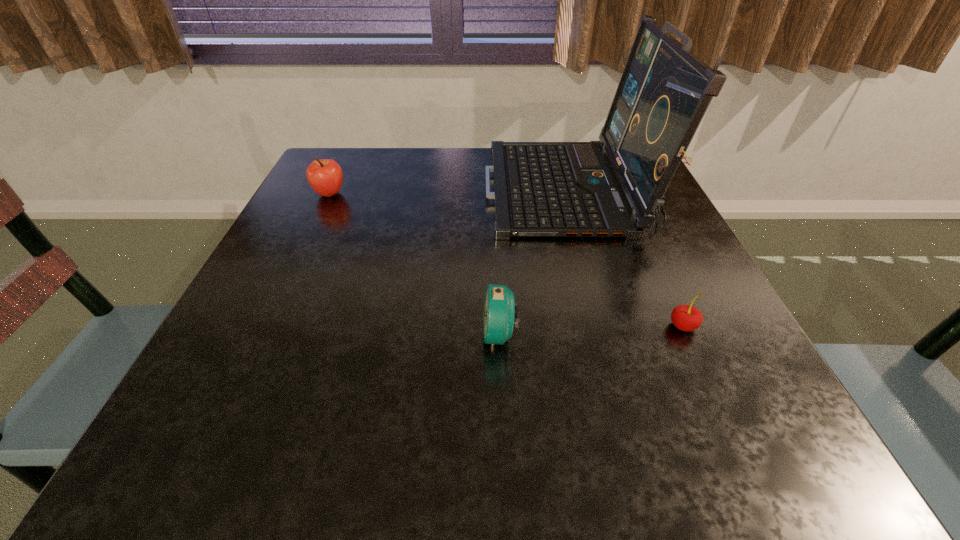
This screenshot has height=540, width=960. Find the location of `vacant region at the near edge`. vacant region at the near edge is located at coordinates (617, 446).

Where is `vacant space at the left edge of the desktop`? This screenshot has height=540, width=960. vacant space at the left edge of the desktop is located at coordinates (353, 214).

This screenshot has height=540, width=960. What are the coordinates of `vacant space at the right edge` in the screenshot? It's located at (621, 253).

Locate an element on the screen. This screenshot has height=540, width=960. free spot between the leftmost object and the cherry is located at coordinates (506, 260).

Locate an element on the screen. The height and width of the screenshot is (540, 960). empty space between the apple and the cherry is located at coordinates (506, 260).

Find the location of a particular element. The width and height of the screenshot is (960, 540). vacant space in between the apple and the cherry is located at coordinates (506, 260).

The image size is (960, 540). In order to click on free spot between the tallest object and the leftmost object in this screenshot , I will do `click(448, 193)`.

Where is `free spot between the leftmost object and the alarm clock`? free spot between the leftmost object and the alarm clock is located at coordinates point(415,264).

Locate an element on the screen. free area in between the laptop computer and the cherry is located at coordinates (625, 259).

This screenshot has height=540, width=960. I want to click on vacant area between the cherry and the alarm clock, so click(591, 330).